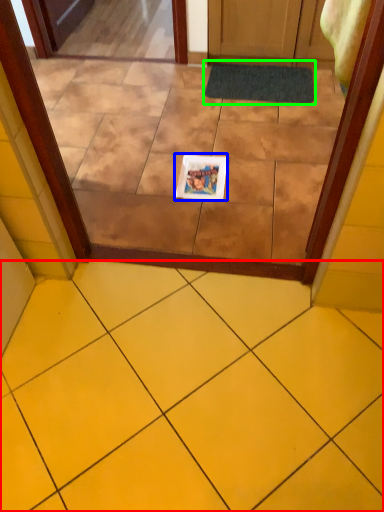
Question: Considering the real-world distances, which object is farthest from ceramic tile (highlighted by a red box)? copy (highlighted by a blue box) or bath mat (highlighted by a green box)?

Choices:
 (A) copy
 (B) bath mat

Answer: (B)